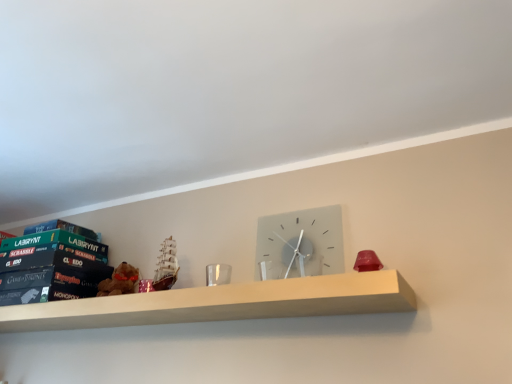
Question: From the image's perspective, is satin gray clock at center positioned above or below hardcover book at left, positioned as the third paperback book in top-to-bottom order?

Choices:
 (A) above
 (B) below

Answer: (A)

Question: Would you say satin gray clock at center is to the left or to the right of hardcover book at left, positioned as the third paperback book in top-to-bottom order, in the picture?

Choices:
 (A) right
 (B) left

Answer: (A)

Question: Which is farther from the wooden shelf at center?

Choices:
 (A) hardcover book at left, which appears as the 1th paperback book when ordered from the bottom
 (B) green matte board game at left, which ranks as the 1th paperback book in top-to-bottom order
 (C) green matte board game box at left, which appears as the second paperback book when ordered from the bottom
 (D) satin gray clock at center

Answer: (B)

Question: Estimate the real-world distances between objects in this image. Which object is closer to the hardcover book at left, which appears as the 1th paperback book when ordered from the bottom?

Choices:
 (A) green matte board game at left, positioned as the third paperback book in bottom-to-top order
 (B) green matte board game box at left, positioned as the 2th paperback book in top-to-bottom order
 (C) wooden shelf at center
 (D) satin gray clock at center

Answer: (B)